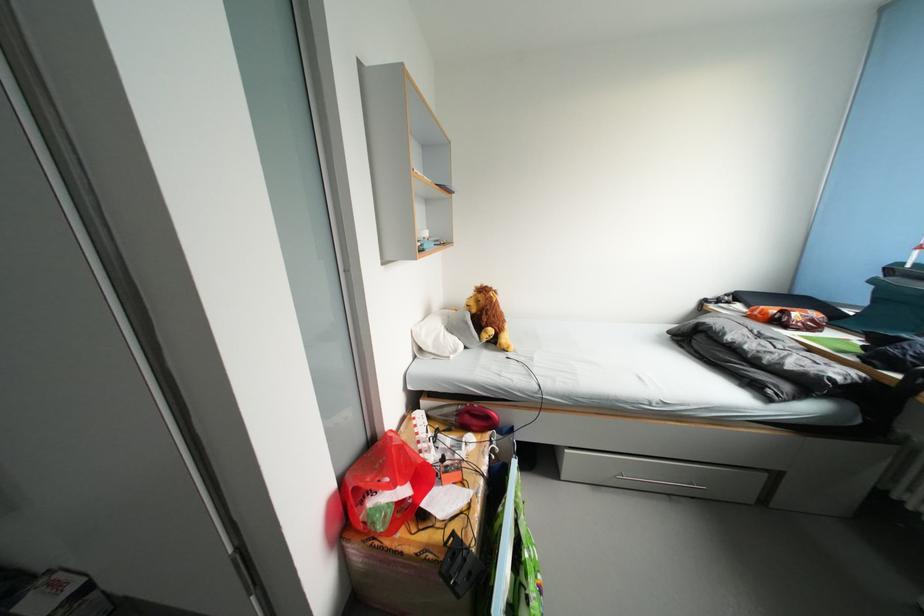
You are a GUI agent. You are given a task and a screenshot of the screen. Output one action in this format:
    pyautogui.click(x=<x>, y=<y>)
    Task: Click on the sliding door handle
    The width and height of the screenshot is (924, 616).
    Given the screenshot: What is the action you would take?
    pyautogui.click(x=241, y=570)